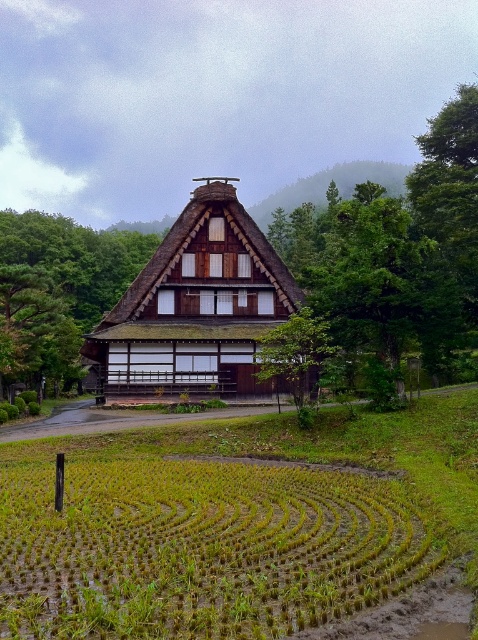
Question: Which point is farther from the camera taking this photo?

Choices:
 (A) (206, 330)
 (B) (280, 205)

Answer: (B)

Question: Where is thatched roof hut at center located in relation to green leafy hillside at upper center in the image?

Choices:
 (A) below
 (B) above

Answer: (A)

Question: Which of these objects is positioned closest to the green grassy rice field at lower center?

Choices:
 (A) thatched roof hut at center
 (B) green leafy hillside at upper center

Answer: (A)

Question: Does green grassy rice field at lower center appear on the right side of thatched roof hut at center?

Choices:
 (A) yes
 (B) no

Answer: (A)

Question: Which of these objects is positioned closest to the thatched roof hut at center?

Choices:
 (A) green leafy hillside at upper center
 (B) green grassy rice field at lower center

Answer: (B)

Question: Is thatched roof hut at center below green leafy hillside at upper center?

Choices:
 (A) yes
 (B) no

Answer: (A)